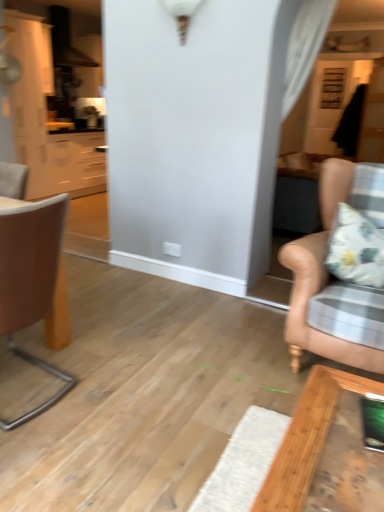
Question: From a real-world perspective, is brown leather chair at left, positioned as the 2th chair in right-to-left order, under matte white cabinets at left?

Choices:
 (A) yes
 (B) no

Answer: (A)

Question: Is matte white cabinets at left at the back of brown leather chair at left, which ranks as the first chair in left-to-right order?

Choices:
 (A) yes
 (B) no

Answer: (B)

Question: From the image's perspective, is brown leather chair at left, positioned as the 2th chair in right-to-left order, located above matte white cabinets at left?

Choices:
 (A) yes
 (B) no

Answer: (B)

Question: Does brown leather chair at left, which ranks as the first chair in left-to-right order, turn towards matte white cabinets at left?

Choices:
 (A) no
 (B) yes

Answer: (A)

Question: Considering the relative positions of brown leather chair at left, which ranks as the first chair in left-to-right order, and matte white cabinets at left in the image provided, is brown leather chair at left, which ranks as the first chair in left-to-right order, to the right of matte white cabinets at left from the viewer's perspective?

Choices:
 (A) no
 (B) yes

Answer: (B)

Question: Does brown leather chair at left, positioned as the 2th chair in right-to-left order, have a smaller size compared to matte white cabinets at left?

Choices:
 (A) no
 (B) yes

Answer: (B)

Question: From the image's perspective, is brown leather chair at left, positioned as the 2th chair in right-to-left order, over leather couch at right, arranged as the second chair when viewed from the left?

Choices:
 (A) yes
 (B) no

Answer: (B)

Question: Does brown leather chair at left, positioned as the 2th chair in right-to-left order, have a lesser width compared to leather couch at right, which is the first chair in right-to-left order?

Choices:
 (A) no
 (B) yes

Answer: (B)

Question: From a real-world perspective, is brown leather chair at left, positioned as the 2th chair in right-to-left order, positioned over leather couch at right, arranged as the second chair when viewed from the left, based on gravity?

Choices:
 (A) no
 (B) yes

Answer: (A)

Question: From the image's perspective, is brown leather chair at left, positioned as the 2th chair in right-to-left order, below leather couch at right, arranged as the second chair when viewed from the left?

Choices:
 (A) no
 (B) yes

Answer: (B)

Question: Is brown leather chair at left, which ranks as the first chair in left-to-right order, closer to the viewer compared to leather couch at right, which is the first chair in right-to-left order?

Choices:
 (A) yes
 (B) no

Answer: (A)

Question: Can you confirm if brown leather chair at left, positioned as the 2th chair in right-to-left order, is positioned to the left of leather couch at right, which is the first chair in right-to-left order?

Choices:
 (A) yes
 (B) no

Answer: (A)

Question: From the image's perspective, is matte white cabinets at left over brown leather chair at left, which ranks as the first chair in left-to-right order?

Choices:
 (A) no
 (B) yes

Answer: (B)